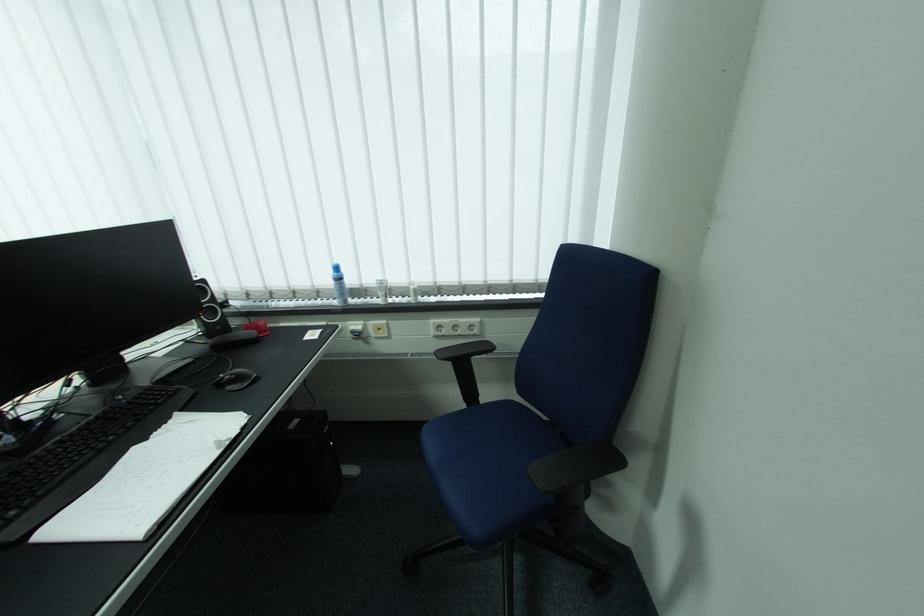
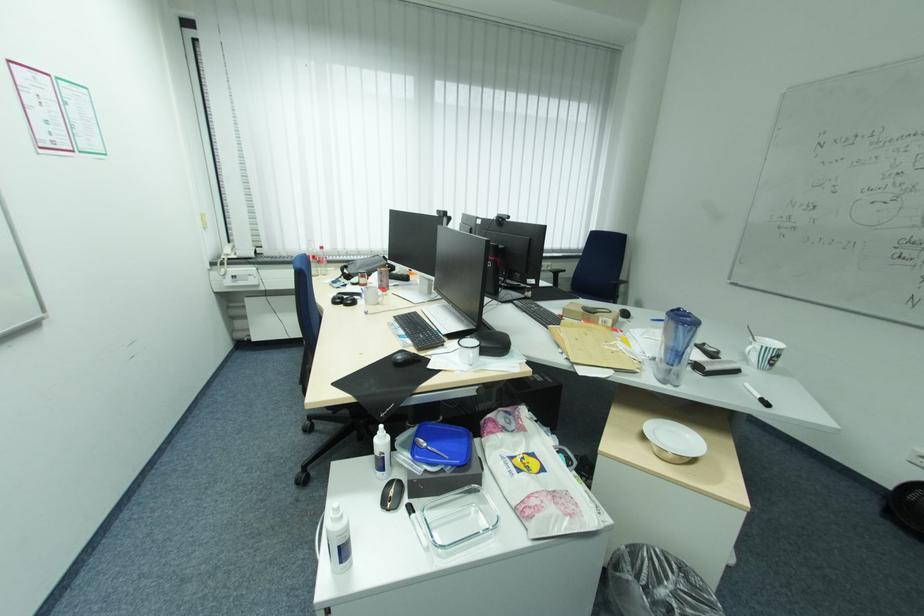
Locate, in the second image, the point that corresponds to [478,326] in the first image.

(554, 265)